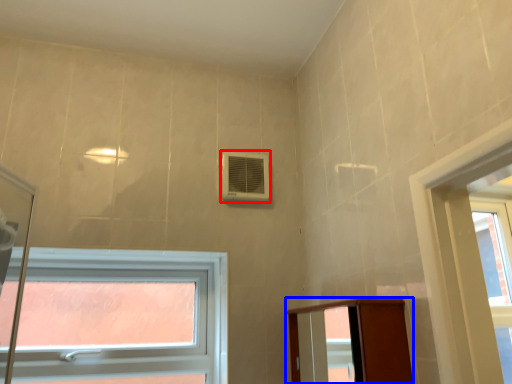
Question: Which point is further to the camera, air conditioning (highlighted by a red box) or elevator (highlighted by a blue box)?

Choices:
 (A) air conditioning
 (B) elevator

Answer: (A)